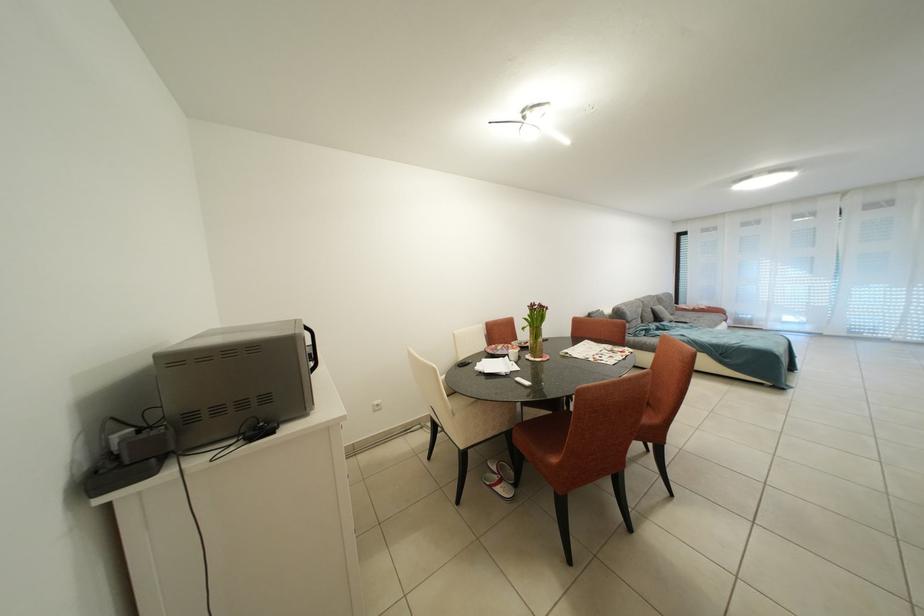
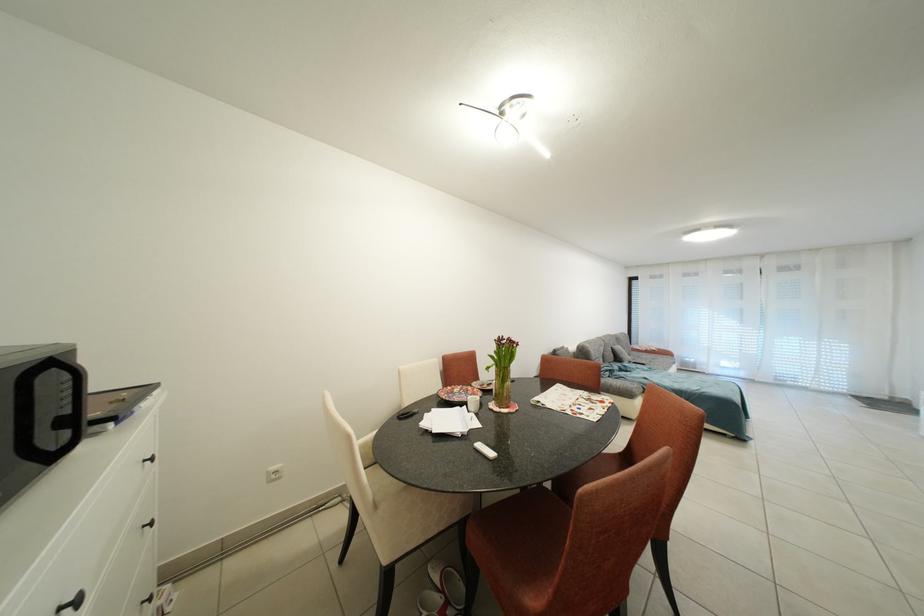
Question: In a continuous first-person perspective shot, in which direction is the camera moving?

Choices:
 (A) Left
 (B) Right
 (C) Forward
 (D) Backward

Answer: (C)